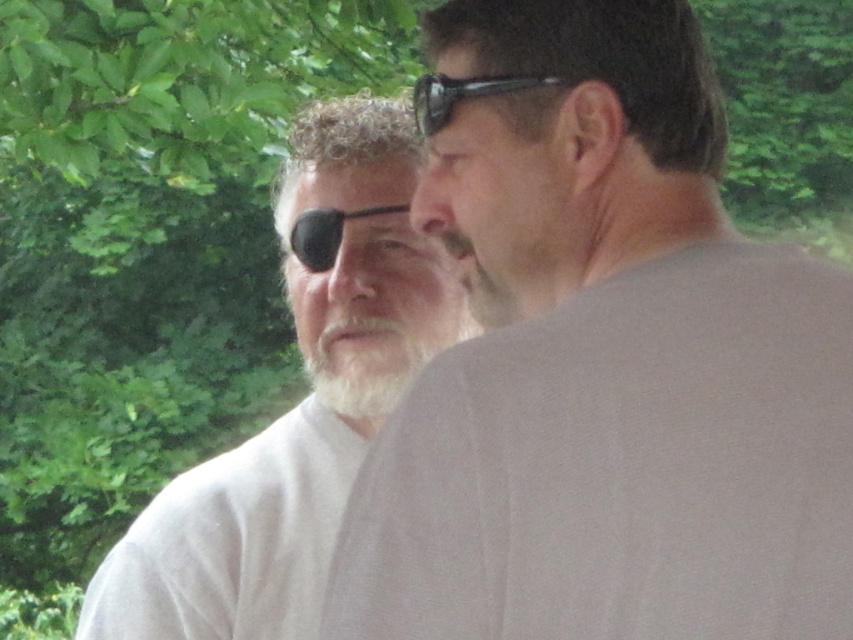
You are standing in a park and see a person wearing a white matte shirt at center. If you want to approach them without getting too close, what is the minimum distance you should maintain?

The white matte shirt at center is 34.82 inches away from viewer. To maintain a respectful distance, you should stay at least 34.82 inches away.

You are a fashion designer observing the two items in the image. Which item, the white matte shirt at center or the black rubber goggles at upper center, would you say is larger in size?

The white matte shirt at center is bigger than the black rubber goggles at upper center, so the white matte shirt at center is larger in size.

Looking at this image, you are a photographer trying to capture a portrait of both the white matte shirt at center and the white soft beard at center. Since you want to ensure both subjects are fully visible in your frame, which subject should you position closer to the left side of the camera viewfinder to avoid obstruction from the foliage?

The white soft beard at center should be positioned closer to the left side of the camera viewfinder because the white matte shirt at center is to the right of it, so moving the white soft beard at center leftward would help keep both subjects clear of the foliage obstruction.